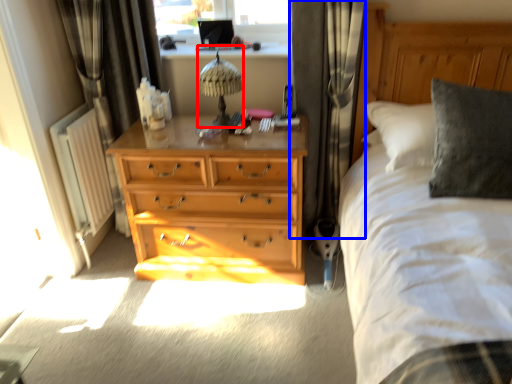
Question: Among these objects, which one is farthest to the camera, table lamp (highlighted by a red box) or curtain (highlighted by a blue box)?

Choices:
 (A) table lamp
 (B) curtain

Answer: (A)